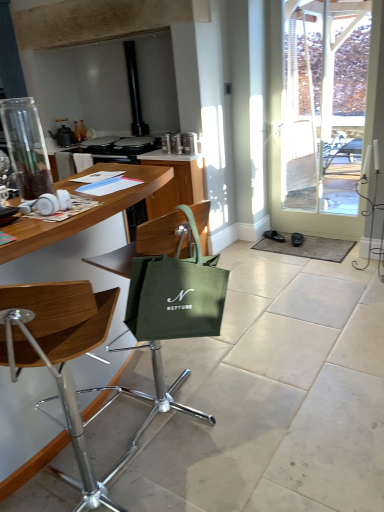
Image resolution: width=384 pixels, height=512 pixels. Identify the location of vacant region in front of green fabric bag at center, acting as the 1th chair starting from the back. (209, 467).